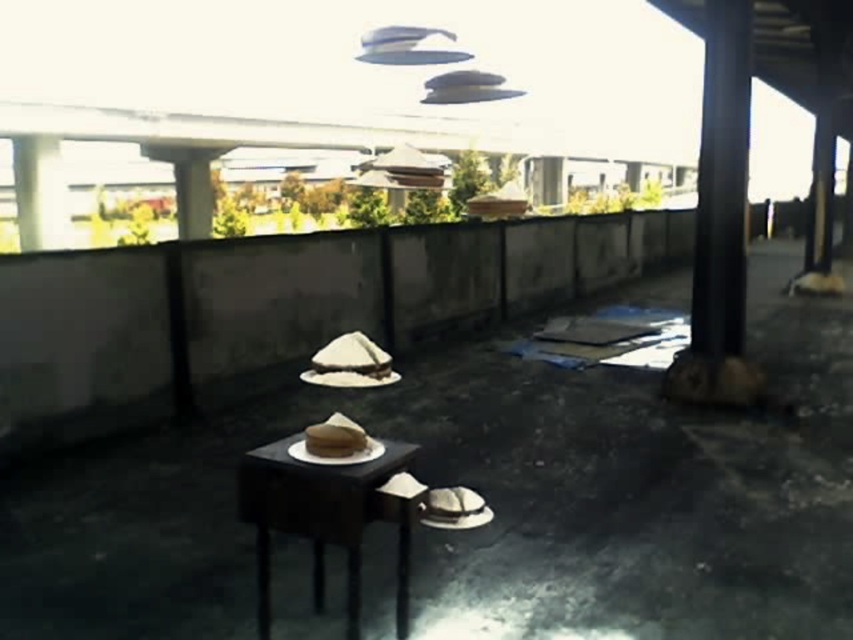
Question: Which point is closer to the camera taking this photo?

Choices:
 (A) (343, 467)
 (B) (457, 508)

Answer: (A)

Question: Is matte black table at center to the left of brown matte cowboy hat at lower center from the viewer's perspective?

Choices:
 (A) no
 (B) yes

Answer: (B)

Question: Does matte black table at center have a larger size compared to brown matte cowboy hat at lower center?

Choices:
 (A) no
 (B) yes

Answer: (B)

Question: Is matte black table at center wider than brown matte cowboy hat at lower center?

Choices:
 (A) no
 (B) yes

Answer: (B)